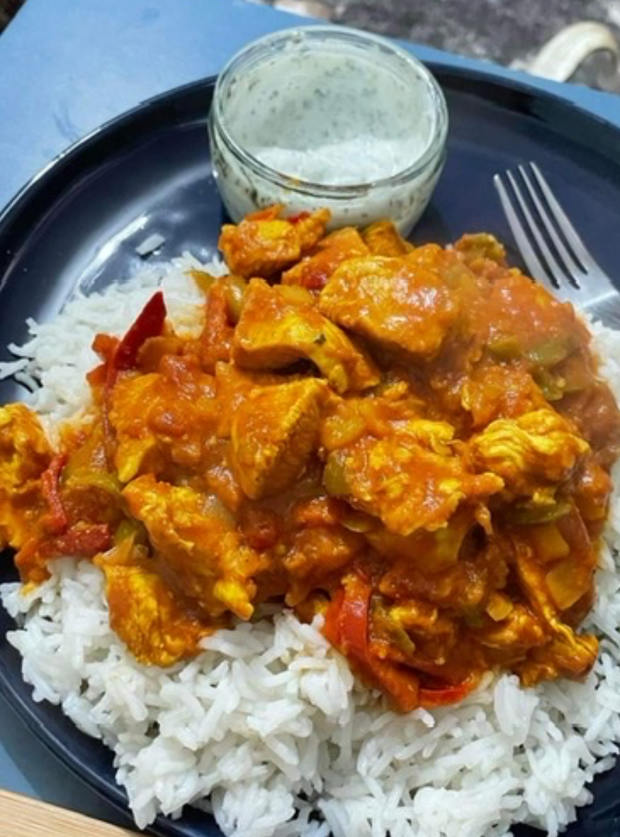
In order to click on place mat in this screenshot , I will do `click(68, 70)`.